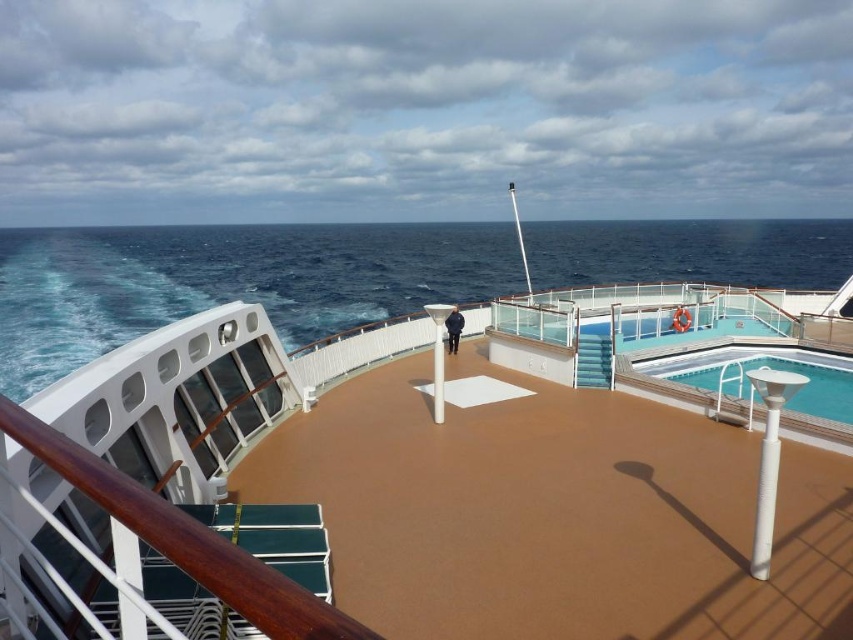
Question: Estimate the real-world distances between objects in this image. Which object is farther from the dark blue uniform at center?

Choices:
 (A) blue water at upper left
 (B) blue glossy pool at upper right

Answer: (A)

Question: Which point appears closest to the camera in this image?

Choices:
 (A) (273, 280)
 (B) (461, 326)

Answer: (B)

Question: Is blue water at upper left thinner than brown rubber deck at center?

Choices:
 (A) yes
 (B) no

Answer: (B)

Question: Considering the relative positions of blue water at upper left and dark blue uniform at center in the image provided, where is blue water at upper left located with respect to dark blue uniform at center?

Choices:
 (A) right
 (B) left

Answer: (A)

Question: Does blue glossy pool at upper right have a greater width compared to dark blue uniform at center?

Choices:
 (A) yes
 (B) no

Answer: (B)

Question: Which point is farther from the camera taking this photo?

Choices:
 (A) (461, 314)
 (B) (177, 419)
 (C) (840, 358)

Answer: (A)